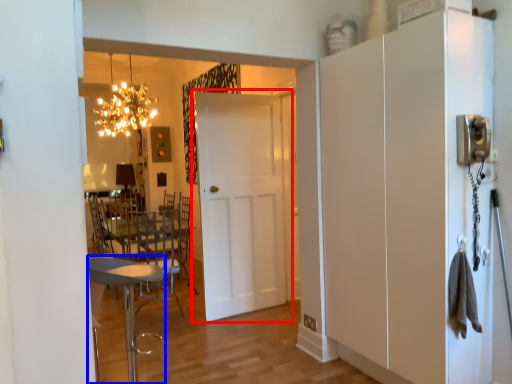
Question: Among these objects, which one is farthest to the camera, door (highlighted by a red box) or chair (highlighted by a blue box)?

Choices:
 (A) door
 (B) chair

Answer: (A)